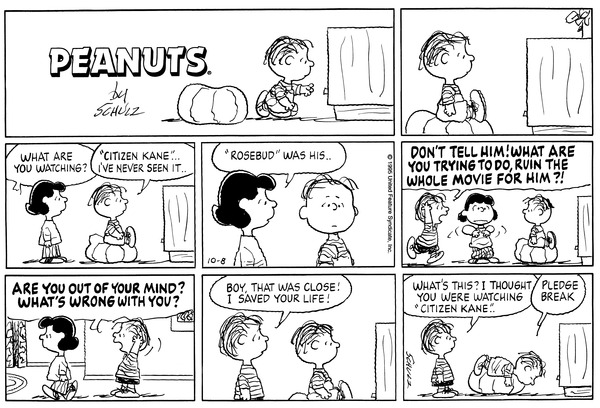
The height and width of the screenshot is (408, 600). I want to click on tv, so click(x=361, y=65), click(x=550, y=72), click(x=587, y=224), click(x=183, y=216), click(x=383, y=363), click(x=568, y=351).